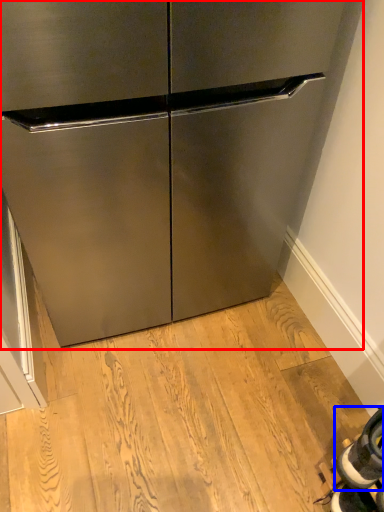
Question: Which object is closer to the camera taking this photo, cabinetry (highlighted by a red box) or shoe (highlighted by a blue box)?

Choices:
 (A) cabinetry
 (B) shoe

Answer: (A)